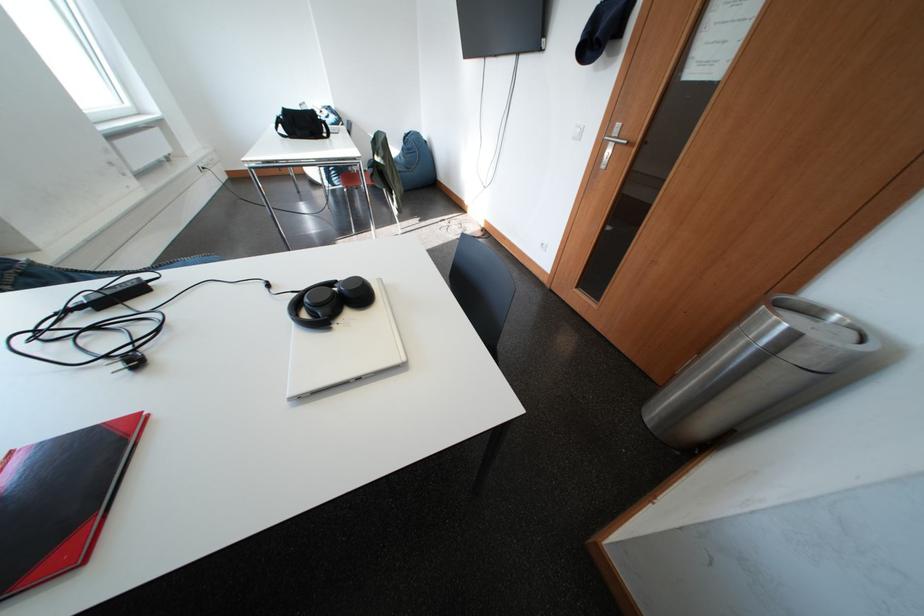
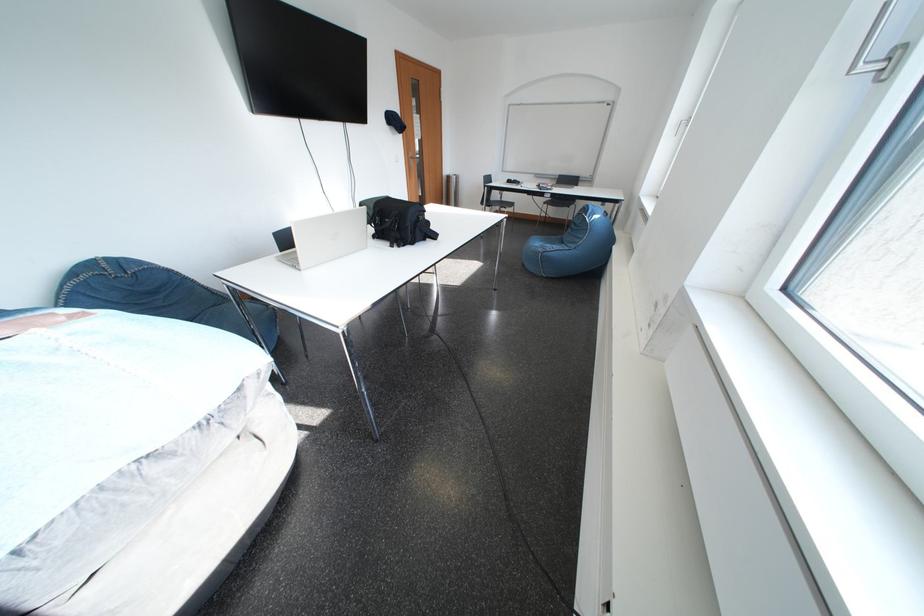
Question: I am providing you with two images of the same scene from different viewpoints. Please identify which objects are invisible in image2.

Choices:
 (A) silver trash can
 (B) silver window handle
 (C) steam wand handle
 (D) black bag

Answer: (D)